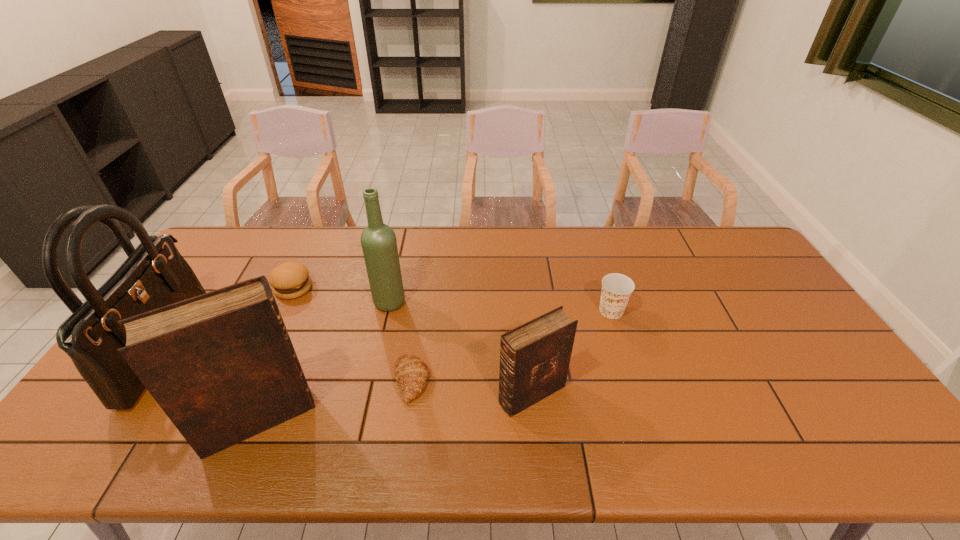
Point out which object is positioned as the sixth nearest to the third shortest object. Please provide its 2D coordinates. Your answer should be formatted as a tuple, i.e. [(x, y)], where the tuple contains the x and y coordinates of a point satisfying the conditions above.

[(154, 275)]

Find the location of a particular element. This screenshot has width=960, height=540. the second closest object to the handbag is located at coordinates (290, 280).

What are the coordinates of `vacant space that satisfies the following two spatial constraints: 1. with an open clasp on the front of the left Bible; 2. on the left side of the leftmost object` in the screenshot? It's located at (116, 419).

Image resolution: width=960 pixels, height=540 pixels. I want to click on free location that satisfies the following two spatial constraints: 1. on the front side of the left Bible; 2. on the left side of the hamburger, so click(231, 419).